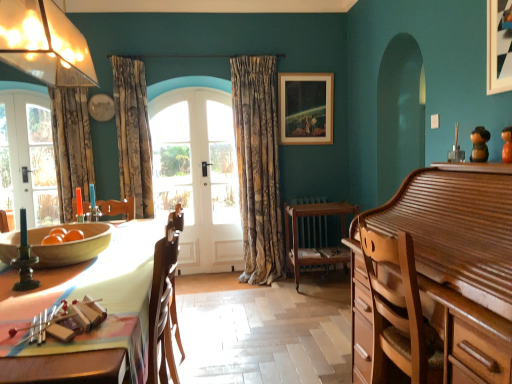
Describe the element at coordinates (312, 231) in the screenshot. This screenshot has width=512, height=384. I see `wooden radiator at center` at that location.

The image size is (512, 384). I want to click on wooden table at center, so click(94, 296).

The height and width of the screenshot is (384, 512). Describe the element at coordinates (94, 296) in the screenshot. I see `wooden table at center` at that location.

At what (x,y) coordinates should I click in order to perform the action: click on white wooden door at center, the 1th door positioned from the back. Please return your answer as a coordinate pair (x, y). This screenshot has width=512, height=384. Looking at the image, I should click on (198, 176).

In terms of height, does wooden table at center look taller or shorter compared to white wooden door at center, the first door when ordered from right to left?

wooden table at center is shorter than white wooden door at center, the first door when ordered from right to left.

Is wooden table at center situated inside white wooden door at center, the second door positioned from the front, or outside?

The correct answer is: outside.

Which is behind, wooden table at center or white wooden door at center, the 1th door positioned from the back?

white wooden door at center, the 1th door positioned from the back, is further from the camera.

Considering the relative positions of wooden table at center and white wooden door at center, the first door when ordered from right to left, in the image provided, is wooden table at center to the right of white wooden door at center, the first door when ordered from right to left, from the viewer's perspective?

In fact, wooden table at center is to the left of white wooden door at center, the first door when ordered from right to left.

Is wooden bowl at table located within wooden radiator at center?

No, wooden bowl at table is not surrounded by wooden radiator at center.

How many degrees apart are the facing directions of wooden radiator at center and wooden bowl at table?

The angular difference between wooden radiator at center and wooden bowl at table is 87.7 degrees.

Between point (318, 198) and point (54, 245), which one is positioned behind?

Positioned behind is point (318, 198).

From a real-world perspective, is wooden radiator at center positioned above or below wooden bowl at table?

Clearly, from a real-world perspective, wooden radiator at center is below wooden bowl at table.

Does point (135, 259) lie in front of point (294, 211)?

Yes, it is in front of point (294, 211).

From a real-world perspective, who is located lower, wooden table at center or wooden chair at center?

From a 3D spatial view, wooden chair at center is below.

Which is more to the right, wooden table at center or wooden chair at center?

Positioned to the right is wooden chair at center.

Is wooden table at center facing towards wooden chair at center?

No, wooden table at center is not oriented towards wooden chair at center.

Who is smaller, white glossy door at left, the 2th door viewed from the back, or wooden chair at center?

white glossy door at left, the 2th door viewed from the back.

In the image, there is a white glossy door at left, the 2th door when ordered from right to left. Where is `chair below it (from the image's perspective)`? The height and width of the screenshot is (384, 512). chair below it (from the image's perspective) is located at coordinates (314, 236).

Is white glossy door at left, the 2th door when ordered from right to left, not within wooden chair at center?

Yes.

From the image's perspective, is white glossy door at left, the 2th door viewed from the back, beneath wooden chair at center?

A: No, from the image's perspective, white glossy door at left, the 2th door viewed from the back, is not below wooden chair at center.

Does translucent glass lampshade at upper left have a smaller size compared to white wooden door at center, the 1th door positioned from the back?

Yes, translucent glass lampshade at upper left is smaller than white wooden door at center, the 1th door positioned from the back.

Is translucent glass lampshade at upper left wider than white wooden door at center, the first door when ordered from right to left?

Yes, translucent glass lampshade at upper left is wider than white wooden door at center, the first door when ordered from right to left.

Does translucent glass lampshade at upper left have a greater height compared to white wooden door at center, the 1th door positioned from the back?

In fact, translucent glass lampshade at upper left may be shorter than white wooden door at center, the 1th door positioned from the back.

How different are the orientations of translucent glass lampshade at upper left and white wooden door at center, the 1th door positioned from the back, in degrees?

The facing directions of translucent glass lampshade at upper left and white wooden door at center, the 1th door positioned from the back, are 92 degrees apart.

From the image's perspective, which object appears higher, white glass door at center or gold-patterned fabric curtain at center, acting as the 1th curtain starting from the right?

From the image's view, gold-patterned fabric curtain at center, acting as the 1th curtain starting from the right, is above.

Relative to gold-patterned fabric curtain at center, acting as the 1th curtain starting from the right, is white glass door at center in front or behind?

Visually, white glass door at center is located behind gold-patterned fabric curtain at center, acting as the 1th curtain starting from the right.

Is white glass door at center positioned beyond the bounds of gold-patterned fabric curtain at center, which appears as the third curtain when viewed from the left?

Yes, white glass door at center is located beyond the bounds of gold-patterned fabric curtain at center, which appears as the third curtain when viewed from the left.

Based on the photo, is white glass door at center touching gold-patterned fabric curtain at center, which appears as the third curtain when viewed from the left?

No, white glass door at center is not beside gold-patterned fabric curtain at center, which appears as the third curtain when viewed from the left.

Between wooden chair at center and wooden radiator at center, which one is positioned in front?

Positioned in front is wooden chair at center.

Would you consider wooden chair at center to be distant from wooden radiator at center?

Actually, wooden chair at center and wooden radiator at center are a little close together.

Is wooden chair at center spatially inside wooden radiator at center, or outside of it?

wooden chair at center is not enclosed by wooden radiator at center.

Starting from the wooden table at center, which door is the 2nd one behind? Please provide its 2D coordinates.

[(198, 176)]

Find the location of a particular element. radiator that appears on the right of wooden bowl at table is located at coordinates (312, 231).

Based on their spatial positions, is floral fabric curtain at left, positioned as the 2th curtain in right-to-left order, or white glossy door at left, the 2th door viewed from the back, further from wooden radiator at center?

white glossy door at left, the 2th door viewed from the back, is further to wooden radiator at center.

Which object lies further to the anchor point wooden bowl at table, white wooden door at center, the first door when ordered from right to left, or gold-patterned fabric curtain at center, acting as the 1th curtain starting from the right?

Among the two, gold-patterned fabric curtain at center, acting as the 1th curtain starting from the right, is located further to wooden bowl at table.

Estimate the real-world distances between objects in this image. Which object is closer to translucent glass lampshade at upper left, wooden radiator at center or white wooden door at center, placed as the second door when sorted from left to right?

white wooden door at center, placed as the second door when sorted from left to right.

From the image, which object appears to be farther from white glass door at center, wooden chair at center or white wooden door at center, the first door when ordered from right to left?

Based on the image, wooden chair at center appears to be further to white glass door at center.

From the image, which object appears to be nearer to floral fabric curtain at left, positioned as the third curtain in right-to-left order, wooden bowl at table or wooden picture frame at upper center?

wooden bowl at table lies closer to floral fabric curtain at left, positioned as the third curtain in right-to-left order, than the other object.

Estimate the real-world distances between objects in this image. Which object is further from floral fabric curtain at left, positioned as the third curtain in right-to-left order, glossy wood cabinet at right or white glass door at center?

glossy wood cabinet at right lies further to floral fabric curtain at left, positioned as the third curtain in right-to-left order, than the other object.

Based on their spatial positions, is white wooden door at center, placed as the second door when sorted from left to right, or translucent glass lampshade at upper left further from wooden picture frame at upper center?

translucent glass lampshade at upper left.

Looking at the image, which one is located closer to white glossy door at left, the 2th door when ordered from right to left, wooden picture frame at upper center or floral fabric curtain at left, positioned as the 2th curtain in right-to-left order?

floral fabric curtain at left, positioned as the 2th curtain in right-to-left order, is closer to white glossy door at left, the 2th door when ordered from right to left.

The width and height of the screenshot is (512, 384). Identify the location of bowl between wooden table at center and floral fabric curtain at left, which appears as the 1th curtain when viewed from the left, in the front-back direction. (70, 244).

This screenshot has width=512, height=384. Find the location of `curtain located between translucent glass lampshade at upper left and wooden chair at center in the depth direction`. curtain located between translucent glass lampshade at upper left and wooden chair at center in the depth direction is located at coordinates (133, 133).

Image resolution: width=512 pixels, height=384 pixels. What are the coordinates of `picture frame between wooden bowl at table and white glass door at center in the front-back direction` in the screenshot? It's located at (306, 108).

The height and width of the screenshot is (384, 512). I want to click on door between floral fabric curtain at left, positioned as the 2th curtain in right-to-left order, and wooden chair at center, so click(x=198, y=176).